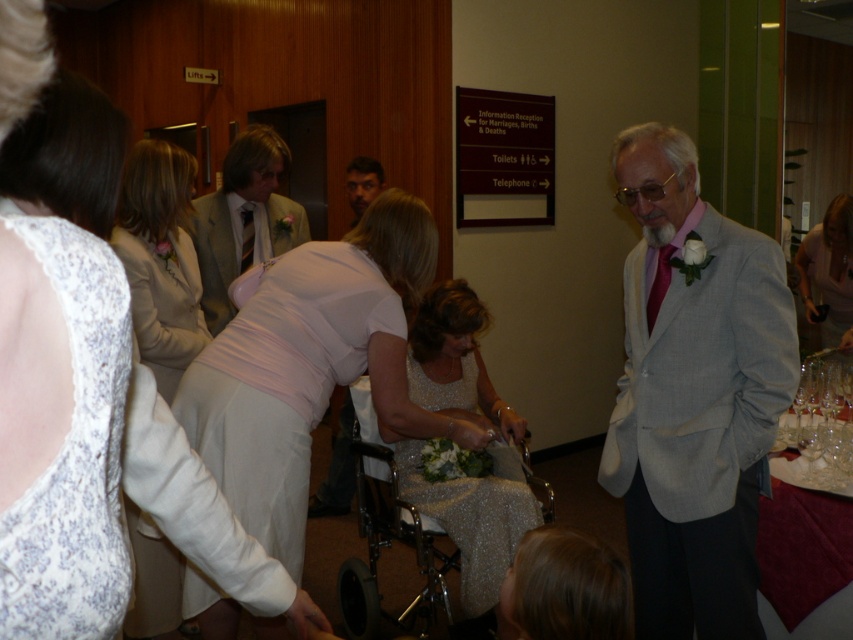
Question: Observing the image, what is the correct spatial positioning of white lace dress at center in reference to dark brown hair at center?

Choices:
 (A) below
 (B) above

Answer: (A)

Question: Is gray textured suit at right further to camera compared to matte white dress at center?

Choices:
 (A) yes
 (B) no

Answer: (B)

Question: Observing the image, what is the correct spatial positioning of beige fabric suit at left in reference to dark brown hair at center?

Choices:
 (A) left
 (B) right

Answer: (A)

Question: Among these objects, which one is farthest from the camera?

Choices:
 (A) beige fabric suit at left
 (B) clear glassware at right

Answer: (A)

Question: Which of the following is the farthest from the observer?

Choices:
 (A) gray textured suit at right
 (B) dark brown hair at center
 (C) silver metallic wheelchair at center
 (D) white lace dress at center

Answer: (B)

Question: Which object is positioned closest to the beige fabric suit at left?

Choices:
 (A) silver metallic wheelchair at center
 (B) white lace dress at center
 (C) dark brown hair at center
 (D) light pink satin dress at center

Answer: (A)